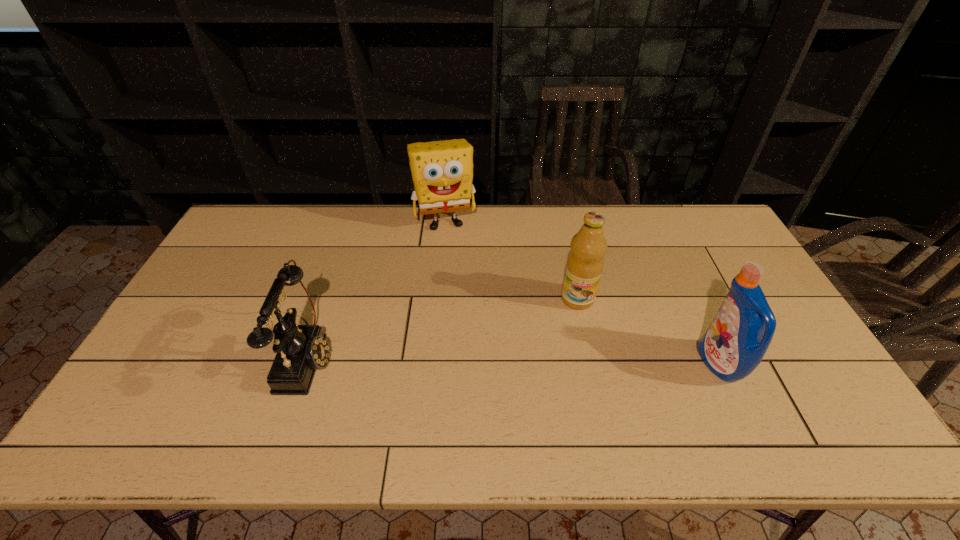
In the image, there is a desktop. Where is `vacant space at the far edge`? This screenshot has height=540, width=960. vacant space at the far edge is located at coordinates (576, 226).

In order to click on free space at the near edge in this screenshot , I will do `click(697, 399)`.

I want to click on free spot at the left edge of the desktop, so click(x=224, y=335).

The width and height of the screenshot is (960, 540). I want to click on vacant space at the right edge, so click(777, 310).

In the image, there is a desktop. At what (x,y) coordinates should I click in order to perform the action: click on vacant space at the near left corner. Please return your answer as a coordinate pair (x, y). This screenshot has height=540, width=960. Looking at the image, I should click on coord(128,399).

The width and height of the screenshot is (960, 540). I want to click on vacant space at the far right corner, so click(684, 217).

You are a GUI agent. You are given a task and a screenshot of the screen. Output one action in this format:
    pyautogui.click(x=<x>, y=<y>)
    Task: Click on the empty location between the leftmost object and the detergent
    The height and width of the screenshot is (540, 960).
    Given the screenshot: What is the action you would take?
    click(x=514, y=360)

The image size is (960, 540). What are the coordinates of `vacant area that lies between the sponge and the telephone` in the screenshot? It's located at (376, 289).

Where is `vacant area that lies between the leftmost object and the olive oil`? This screenshot has width=960, height=540. vacant area that lies between the leftmost object and the olive oil is located at coordinates (443, 327).

The image size is (960, 540). Find the location of `free space between the leftmost object and the second farthest object`. free space between the leftmost object and the second farthest object is located at coordinates (443, 327).